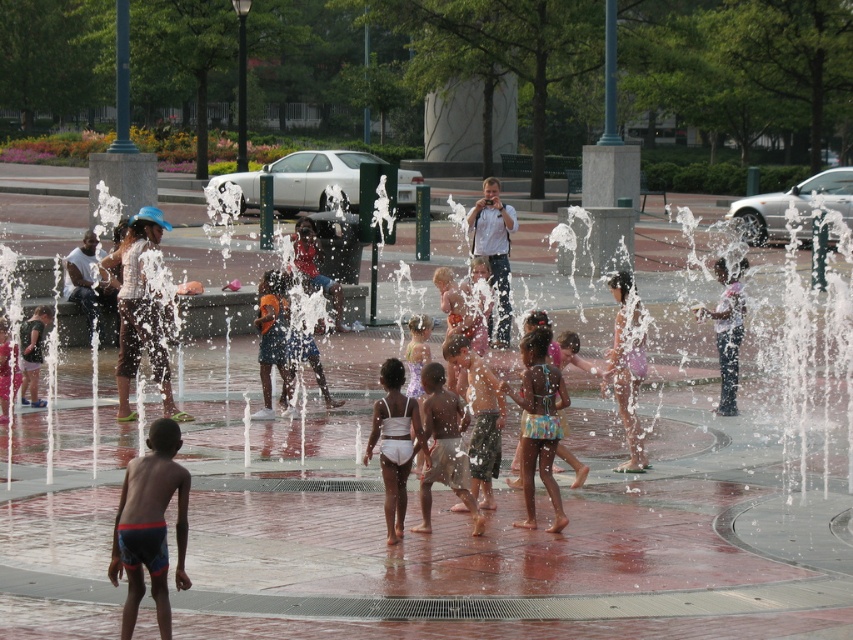
Does purple fabric dress at center appear on the right side of matte blue shorts at center?

Yes, purple fabric dress at center is to the right of matte blue shorts at center.

Is point (614, 288) behind point (344, 328)?

No, it is in front of (344, 328).

Image resolution: width=853 pixels, height=640 pixels. Find the location of `purple fabric dress at center`. purple fabric dress at center is located at coordinates (625, 369).

Does purple fabric dress at center have a greater width compared to white cotton shirt at center?

Incorrect, purple fabric dress at center's width does not surpass white cotton shirt at center's.

Which is below, purple fabric dress at center or white cotton shirt at center?

purple fabric dress at center

Where is `purple fabric dress at center`? The height and width of the screenshot is (640, 853). purple fabric dress at center is located at coordinates (625, 369).

This screenshot has height=640, width=853. In order to click on clear plastic water at center in this screenshot , I will do (x=537, y=504).

Which is behind, point (784, 515) or point (312, 275)?

Positioned behind is point (312, 275).

The image size is (853, 640). Describe the element at coordinates (537, 504) in the screenshot. I see `clear plastic water at center` at that location.

The width and height of the screenshot is (853, 640). Find the location of `clear plastic water at center`. clear plastic water at center is located at coordinates (537, 504).